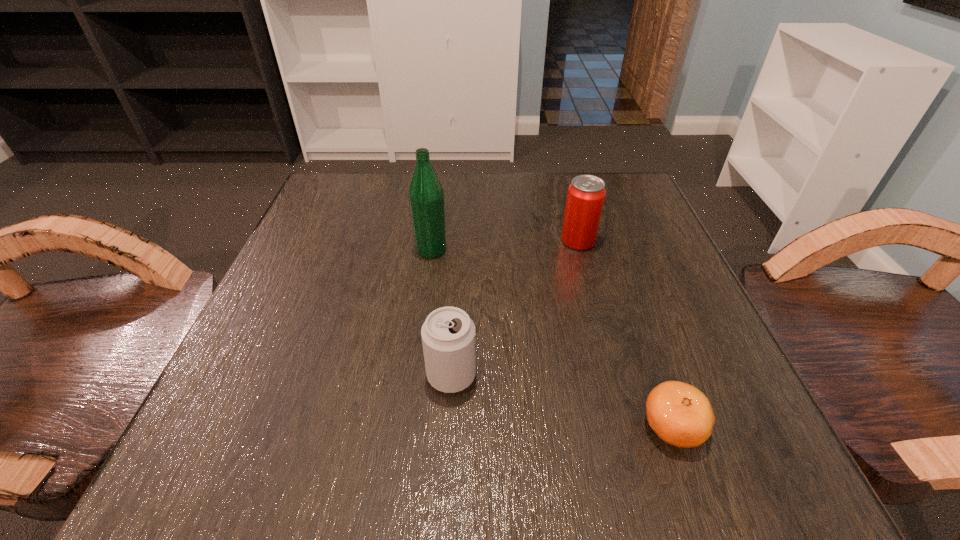
The height and width of the screenshot is (540, 960). What are the coordinates of `the tallest object` in the screenshot? It's located at (426, 197).

At what (x,y) coordinates should I click in order to perform the action: click on the right can. Please return your answer as a coordinate pair (x, y). This screenshot has height=540, width=960. Looking at the image, I should click on (585, 198).

This screenshot has height=540, width=960. I want to click on the nearer can, so click(x=448, y=334).

At what (x,y) coordinates should I click in order to perform the action: click on the left can. Please return your answer as a coordinate pair (x, y). The width and height of the screenshot is (960, 540). Looking at the image, I should click on (448, 334).

Identify the location of the nearest object. (681, 415).

Identify the location of the shortest object. (681, 415).

Find the location of a particular element. Image resolution: width=960 pixels, height=540 pixels. vacant space located on the front of the bottle is located at coordinates (420, 332).

This screenshot has height=540, width=960. Find the location of `vacant space located on the left of the farther can`. vacant space located on the left of the farther can is located at coordinates (526, 241).

Locate an element on the screen. vacant region located 0.270m on the left of the nearer can is located at coordinates (241, 375).

Where is `free space located on the left of the shortest object`? Image resolution: width=960 pixels, height=540 pixels. free space located on the left of the shortest object is located at coordinates (603, 427).